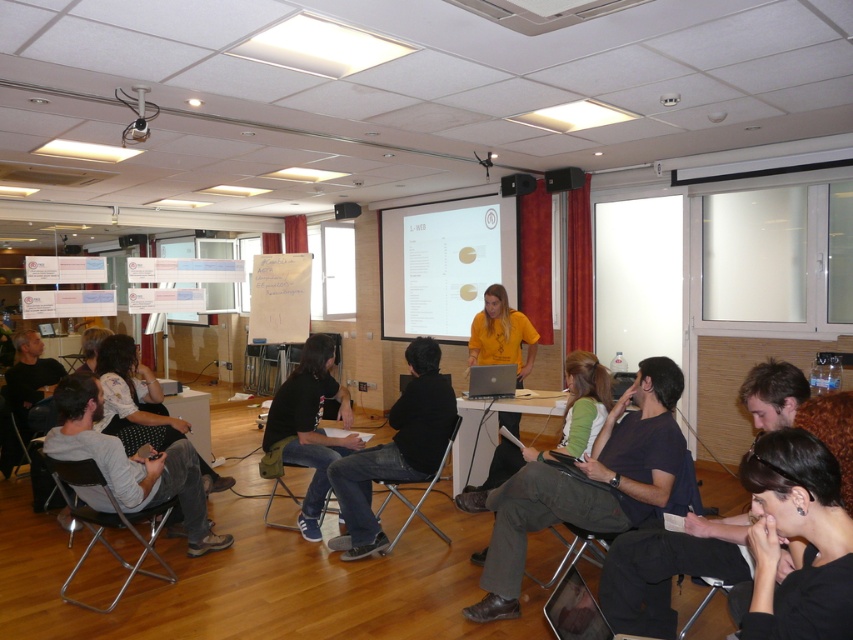
You are standing in the conference room and want to locate the matte yellow shirt at center. According to the room layout, where would you find it?

The matte yellow shirt at center is located at the 2D coordinates point (x=517, y=184) in the room layout.